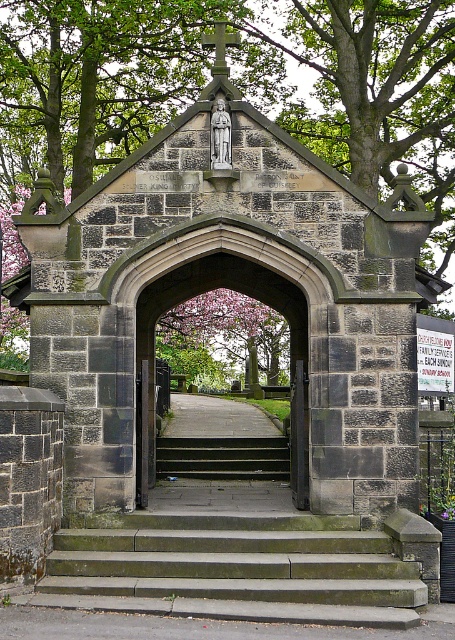
Question: Where is dark stone archway at center located in relation to white plastic sign at center in the image?

Choices:
 (A) left
 (B) right

Answer: (A)

Question: Can you confirm if white plastic sign at center is positioned above wooden door at center?

Choices:
 (A) no
 (B) yes

Answer: (B)

Question: Which object is positioned farthest from the dark stone archway at center?

Choices:
 (A) wooden door at center
 (B) white plastic sign at center
 (C) green stone stairs at center
 (D) dark gray concrete stairs at center

Answer: (C)

Question: Which object is closer to the camera taking this photo?

Choices:
 (A) dark gray concrete stairs at center
 (B) dark stone archway at center
 (C) green stone stairs at center

Answer: (C)

Question: Is green stone stairs at center smaller than wooden door at center?

Choices:
 (A) yes
 (B) no

Answer: (B)

Question: Which point is farther from the camera taking this photo?

Choices:
 (A) 298,456
 (B) 428,355
 (C) 293,316
 (D) 357,620

Answer: (C)